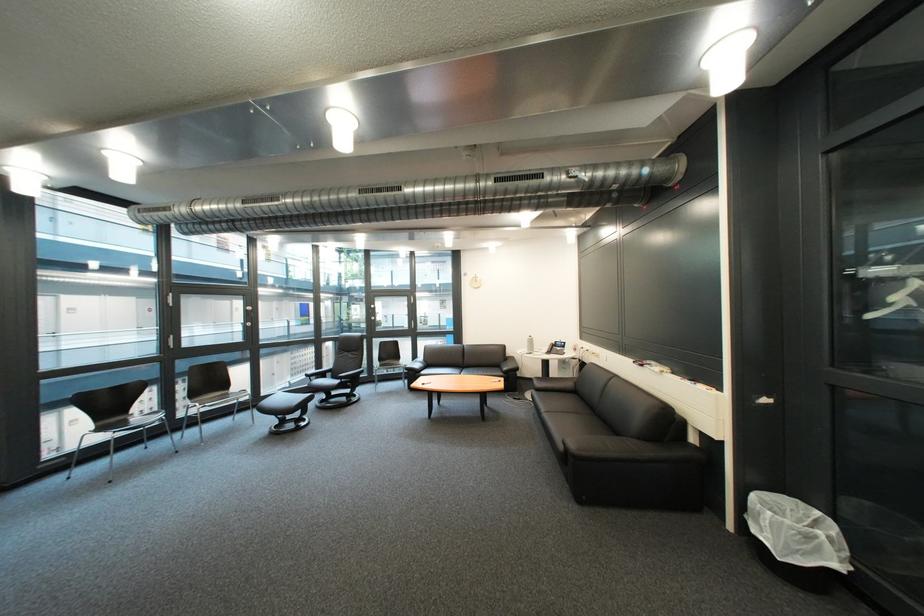
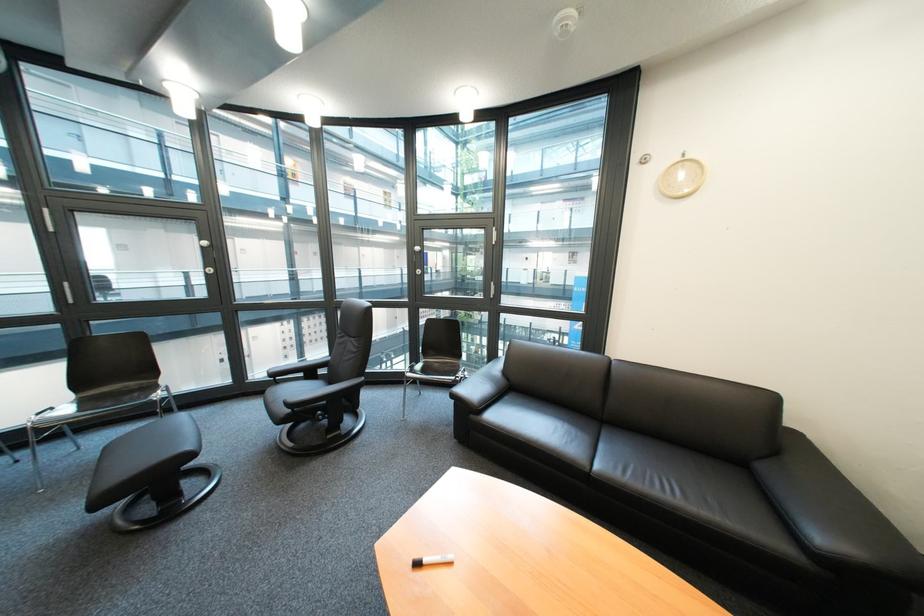
Locate, in the second image, the point that corresponds to the point at 431,376 in the first image.

(485, 418)